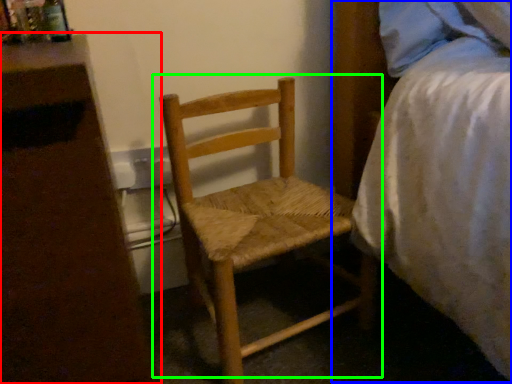
Question: Based on their relative distances, which object is farther from nightstand (highlighted by a red box)? Choose from bed (highlighted by a blue box) and chair (highlighted by a green box).

Choices:
 (A) bed
 (B) chair

Answer: (A)